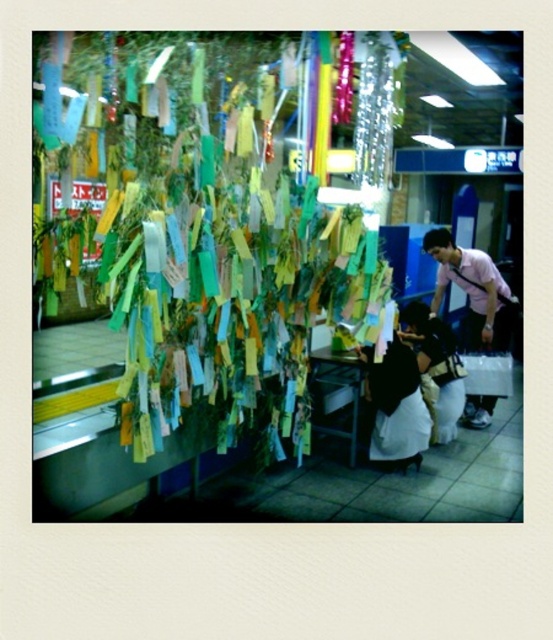
Question: Observing the image, what is the correct spatial positioning of paper tags at left in reference to pink cotton shirt at center?

Choices:
 (A) left
 (B) right

Answer: (A)

Question: Among these objects, which one is nearest to the camera?

Choices:
 (A) black satin skirt at lower center
 (B) paper tags at left
 (C) pink cotton shirt at center

Answer: (B)

Question: Which point is farther from the camera taking this photo?

Choices:
 (A) (180, 86)
 (B) (502, 301)

Answer: (B)

Question: Can you confirm if black satin skirt at lower center is positioned above black fabric bag at center?

Choices:
 (A) no
 (B) yes

Answer: (A)

Question: Based on their relative distances, which object is nearer to the black fabric bag at center?

Choices:
 (A) paper tags at left
 (B) pink cotton shirt at center

Answer: (B)

Question: Is pink cotton shirt at center positioned behind black fabric bag at center?

Choices:
 (A) yes
 (B) no

Answer: (A)